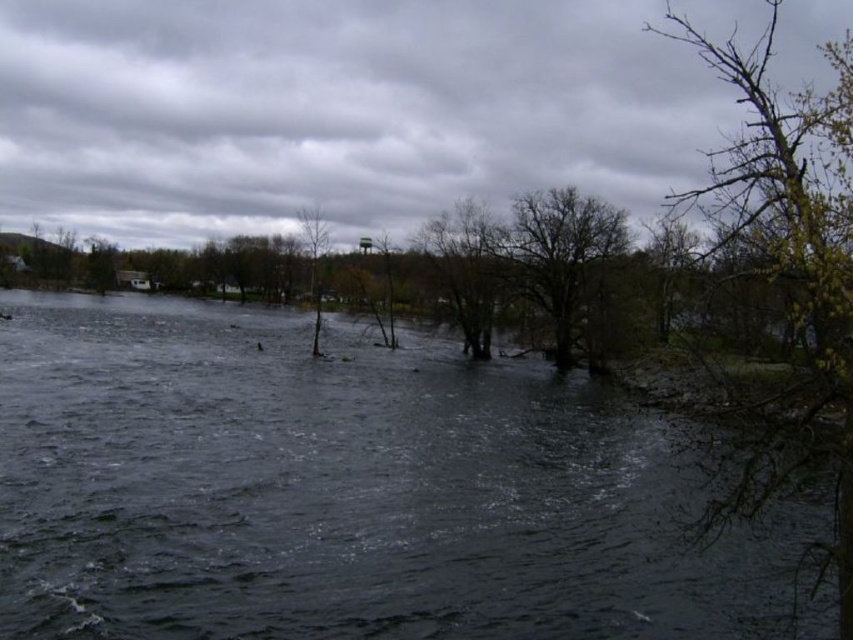
Can you confirm if bare branches at upper right is bigger than bare wood tree at center?

Yes, bare branches at upper right is bigger than bare wood tree at center.

From the picture: Who is shorter, bare branches at upper right or bare wood tree at center?

Standing shorter between the two is bare wood tree at center.

Is point (805, 115) farther from camera compared to point (311, 289)?

No, it is not.

This screenshot has height=640, width=853. Identify the location of bare branches at upper right. (793, 237).

Does point (589, 288) come in front of point (306, 211)?

No, (589, 288) is behind (306, 211).

What do you see at coordinates (560, 257) in the screenshot?
I see `bare branches tree at center` at bounding box center [560, 257].

Find the location of a particular element. Image resolution: width=853 pixels, height=640 pixels. bare branches tree at center is located at coordinates (560, 257).

Between point (750, 188) and point (480, 268), which one is positioned behind?

The point (480, 268) is more distant.

Find the location of a particular element. bare branches at upper right is located at coordinates (793, 237).